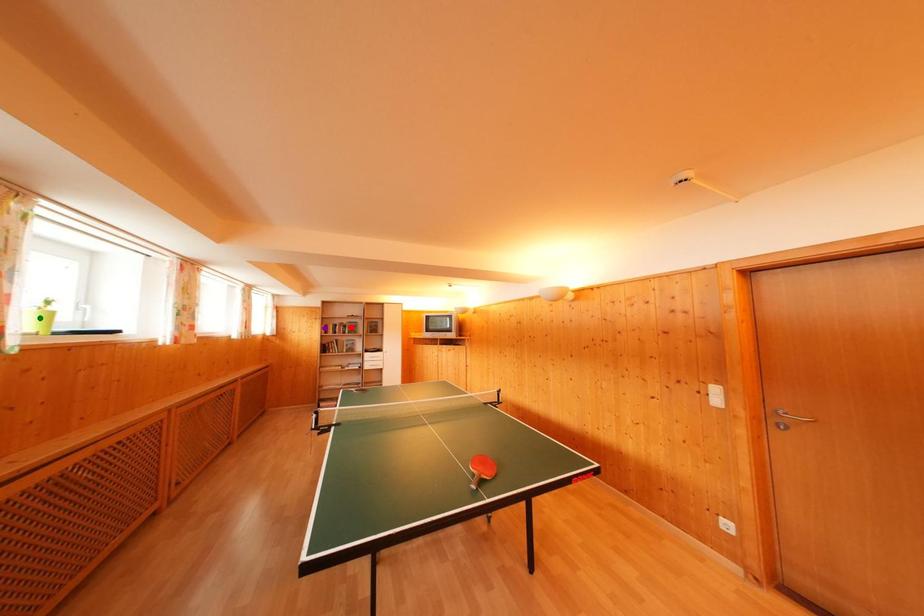
Order these from nearest to farthest:
A) green point
B) red point
C) purple point

green point < purple point < red point